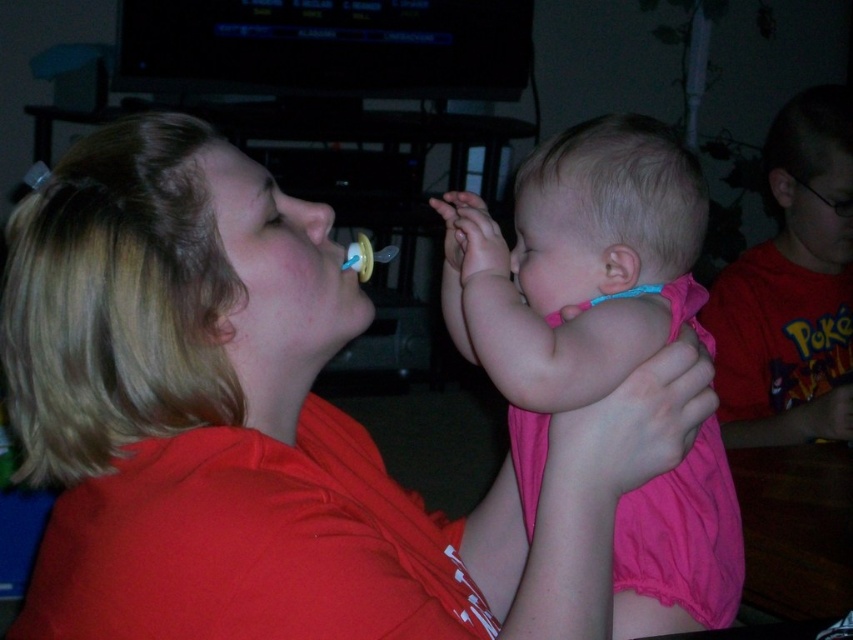
You are standing at point (706,465) and want to walk to point (473,552). Is there a clear path between these two points?

Point (473,552) is behind point (706,465), so there might be an obstacle blocking the path between them.

You are a photographer setting up for a family photo. You notice two pink fabrics in the scene. The pink fabric at center and the pink fabric shirt at right. Which one is narrower?

The pink fabric at center has a lesser width compared to the pink fabric shirt at right, so the pink fabric at center is narrower.